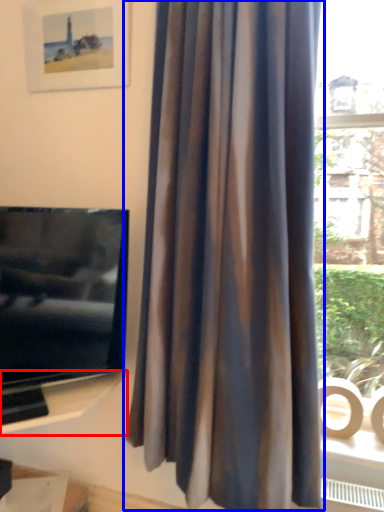
Question: Which point is further to the camera, shelf (highlighted by a red box) or curtain (highlighted by a blue box)?

Choices:
 (A) shelf
 (B) curtain

Answer: (A)